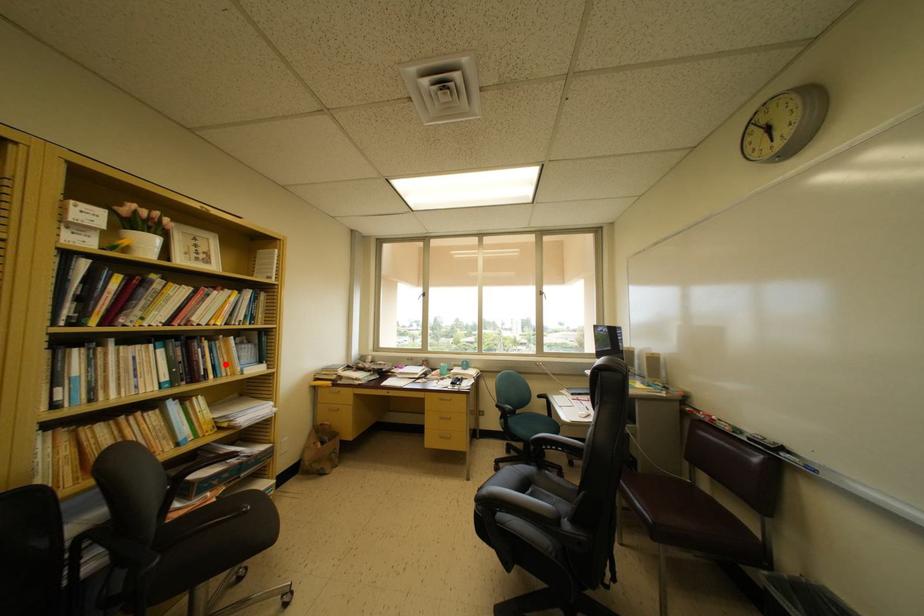
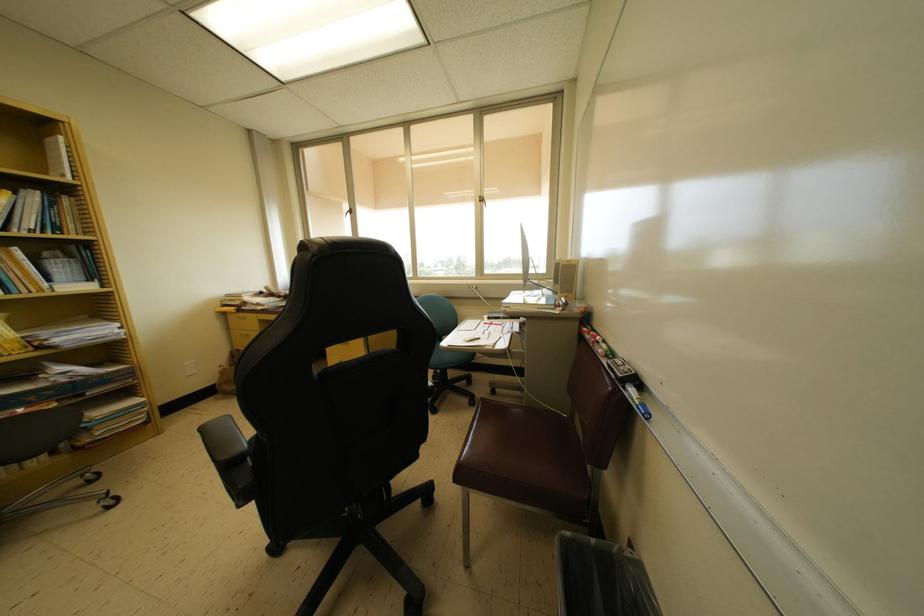
Where in the second image is the point corresponding to the highlighted location from the first image?

(15, 278)